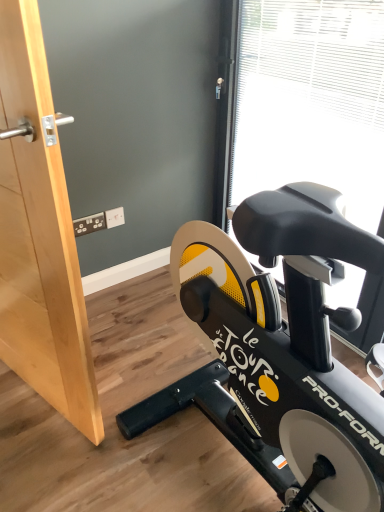
I want to click on vacant region to the right of wooden door at left, so click(x=151, y=394).